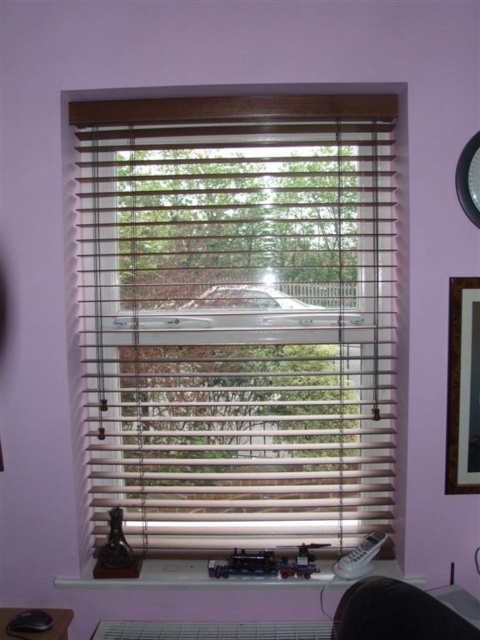
Question: Is wooden blinds at center to the left of wooden picture frame at right from the viewer's perspective?

Choices:
 (A) yes
 (B) no

Answer: (A)

Question: Which object appears farthest from the camera in this image?

Choices:
 (A) black plastic mouse at lower left
 (B) metallic clock at upper right
 (C) wooden picture frame at right

Answer: (C)

Question: Which object is closer to the camera taking this photo?

Choices:
 (A) metallic clock at upper right
 (B) wooden blinds at center

Answer: (A)

Question: Among these points, which one is nearest to the camera?

Choices:
 (A) (29, 632)
 (B) (173, 392)
 (C) (479, 138)

Answer: (A)

Question: Observing the image, what is the correct spatial positioning of wooden blinds at center in reference to metallic clock at upper right?

Choices:
 (A) left
 (B) right

Answer: (A)

Question: Can you confirm if wooden blinds at center is positioned to the left of black plastic mouse at lower left?

Choices:
 (A) no
 (B) yes

Answer: (A)